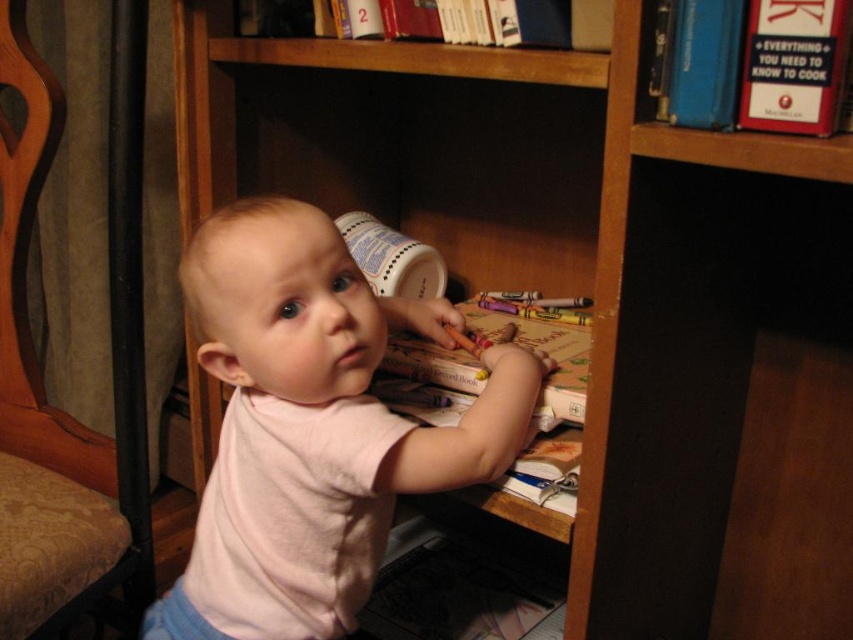
You are a photographer trying to capture the child and the bookshelf. You notice two points marked in the image. Which point, point (770, 49) or point (497, 38), is closer to your camera lens?

Point (770, 49) is closer to the camera than point (497, 38).

A parent wants to ensure their child can safely reach both the pink cotton baby at center and the hardcover book at upper center from their current position. Given that the child can extend their arm 16 inches, will they be able to reach both items without moving?

The pink cotton baby at center and hardcover book at upper center are 16.39 inches apart. Since the child can only extend their arm 16 inches, they will not be able to reach both items without moving.

Looking at this image, the scene has a point marked at coordinates (312, 428). What object is located at that specific point?

The pink cotton baby is located at point (312, 428).